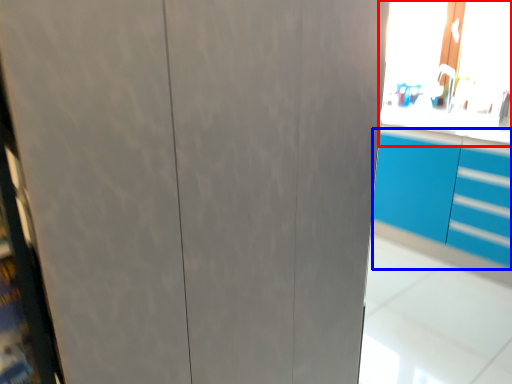
Question: Which object appears closest to the camera in this image, window screen (highlighted by a red box) or cabinetry (highlighted by a blue box)?

Choices:
 (A) window screen
 (B) cabinetry

Answer: (B)